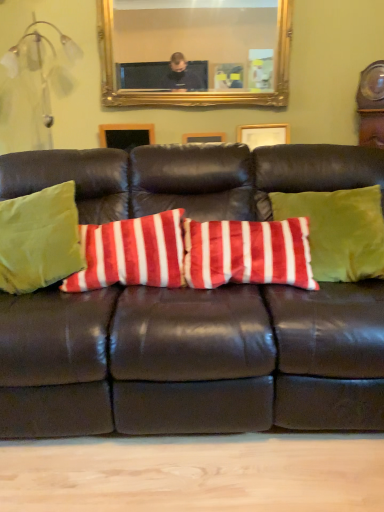
What is the approximate width of matte brown leather couch at center?

matte brown leather couch at center is 1.05 meters in width.

The image size is (384, 512). In order to click on gold-framed mirror at upper center in this screenshot , I will do 194,52.

At what (x,y) coordinates should I click in order to perform the action: click on velvet green pillow at center, placed as the first pillow when sorted from right to left. Please return your answer as a coordinate pair (x, y). This screenshot has width=384, height=512. Looking at the image, I should click on coord(339,231).

At what (x,y) coordinates should I click in order to perform the action: click on matte brown leather couch at center. Please return your answer as a coordinate pair (x, y). This screenshot has height=512, width=384. Looking at the image, I should click on (192, 360).

Is the position of gold-framed mirror at upper center more distant than that of velvet green pillow at center, which is counted as the 3th pillow, starting from the left?

Yes, gold-framed mirror at upper center is further from the camera.

From the image's perspective, is gold-framed mirror at upper center positioned above or below velvet green pillow at center, which is counted as the 3th pillow, starting from the left?

Clearly, from the image's perspective, gold-framed mirror at upper center is above velvet green pillow at center, which is counted as the 3th pillow, starting from the left.

Between gold-framed mirror at upper center and velvet green pillow at center, placed as the first pillow when sorted from right to left, which one appears on the right side from the viewer's perspective?

Positioned to the right is velvet green pillow at center, placed as the first pillow when sorted from right to left.

Is point (244, 70) closer or farther from the camera than point (383, 246)?

Point (244, 70) is positioned farther from the camera compared to point (383, 246).

At what (x,y) coordinates should I click in order to perform the action: click on pillow located underneath the green velvet pillow at left, the 1th pillow in the left-to-right sequence (from a real-world perspective). Please return your answer as a coordinate pair (x, y). Looking at the image, I should click on (132, 253).

From the image's perspective, is green velvet pillow at left, the 1th pillow in the left-to-right sequence, positioned above or below velvety red and white striped pillow at center, which is the 2th pillow from left to right?

Clearly, from the image's perspective, green velvet pillow at left, the 1th pillow in the left-to-right sequence, is above velvety red and white striped pillow at center, which is the 2th pillow from left to right.

Considering the positions of point (75, 264) and point (128, 241), is point (75, 264) closer or farther from the camera than point (128, 241)?

Point (75, 264) appears to be closer to the viewer than point (128, 241).

Are matte brown leather couch at center and green velvet pillow at left, the third pillow viewed from the right, located far from each other?

No, matte brown leather couch at center is not far away from green velvet pillow at left, the third pillow viewed from the right.

Which is more to the right, matte brown leather couch at center or green velvet pillow at left, the 1th pillow in the left-to-right sequence?

matte brown leather couch at center.

Can you confirm if matte brown leather couch at center is taller than green velvet pillow at left, the third pillow viewed from the right?

Correct, matte brown leather couch at center is much taller as green velvet pillow at left, the third pillow viewed from the right.

In terms of size, does velvet green pillow at center, placed as the first pillow when sorted from right to left, appear bigger or smaller than green velvet pillow at left, the third pillow viewed from the right?

In the image, velvet green pillow at center, placed as the first pillow when sorted from right to left, appears to be smaller than green velvet pillow at left, the third pillow viewed from the right.

From the image's perspective, which is above, velvet green pillow at center, placed as the first pillow when sorted from right to left, or green velvet pillow at left, the third pillow viewed from the right?

velvet green pillow at center, placed as the first pillow when sorted from right to left.

From a real-world perspective, is velvet green pillow at center, placed as the first pillow when sorted from right to left, located higher than green velvet pillow at left, the third pillow viewed from the right?

Indeed, from a real-world perspective, velvet green pillow at center, placed as the first pillow when sorted from right to left, stands above green velvet pillow at left, the third pillow viewed from the right.

Does velvet green pillow at center, placed as the first pillow when sorted from right to left, turn towards green velvet pillow at left, the 1th pillow in the left-to-right sequence?

No, velvet green pillow at center, placed as the first pillow when sorted from right to left, is not facing towards green velvet pillow at left, the 1th pillow in the left-to-right sequence.

From a real-world perspective, who is located higher, matte brown leather couch at center or velvety red and white striped pillow at center, which is the 2th pillow from left to right?

From a 3D spatial view, velvety red and white striped pillow at center, which is the 2th pillow from left to right, is above.

There is a matte brown leather couch at center. Identify the location of the 1st pillow above it (from the image's perspective). This screenshot has width=384, height=512. (132, 253).

Considering the relative sizes of matte brown leather couch at center and velvety red and white striped pillow at center, which is the 2th pillow from left to right, in the image provided, is matte brown leather couch at center taller than velvety red and white striped pillow at center, which is the 2th pillow from left to right,?

Correct, matte brown leather couch at center is much taller as velvety red and white striped pillow at center, which is the 2th pillow from left to right.

Is point (96, 277) closer to viewer compared to point (136, 192)?

Yes, it is.

Does velvety red and white striped pillow at center, the second pillow in the right-to-left sequence, have a larger size compared to matte brown leather couch at center?

No.

Considering the relative positions of velvety red and white striped pillow at center, the second pillow in the right-to-left sequence, and matte brown leather couch at center in the image provided, is velvety red and white striped pillow at center, the second pillow in the right-to-left sequence, to the right of matte brown leather couch at center from the viewer's perspective?

Incorrect, velvety red and white striped pillow at center, the second pillow in the right-to-left sequence, is not on the right side of matte brown leather couch at center.

Is velvety red and white striped pillow at center, the second pillow in the right-to-left sequence, spatially inside matte brown leather couch at center, or outside of it?

velvety red and white striped pillow at center, the second pillow in the right-to-left sequence, is contained in matte brown leather couch at center.

Between green velvet pillow at left, the 1th pillow in the left-to-right sequence, and gold-framed mirror at upper center, which one has more height?

green velvet pillow at left, the 1th pillow in the left-to-right sequence.

Between green velvet pillow at left, the third pillow viewed from the right, and gold-framed mirror at upper center, which one has smaller size?

gold-framed mirror at upper center is smaller.

From the image's perspective, is green velvet pillow at left, the 1th pillow in the left-to-right sequence, beneath gold-framed mirror at upper center?

Yes, from the image's perspective, green velvet pillow at left, the 1th pillow in the left-to-right sequence, is below gold-framed mirror at upper center.

Is point (15, 198) more distant than point (119, 68)?

No.

Image resolution: width=384 pixels, height=512 pixels. Find the location of `the 2nd pillow in front of the gold-framed mirror at upper center, starting your count from the anchor`. the 2nd pillow in front of the gold-framed mirror at upper center, starting your count from the anchor is located at coordinates (339, 231).

This screenshot has height=512, width=384. Identify the location of pillow that appears below the green velvet pillow at left, the 1th pillow in the left-to-right sequence (from a real-world perspective). (132, 253).

Which object lies further to the anchor point gold-framed mirror at upper center, velvety red and white striped pillow at center, the second pillow in the right-to-left sequence, or matte brown leather couch at center?

The object further to gold-framed mirror at upper center is matte brown leather couch at center.

Based on the photo, which object lies nearer to the anchor point matte brown leather couch at center, gold-framed mirror at upper center or velvet green pillow at center, placed as the first pillow when sorted from right to left?

velvet green pillow at center, placed as the first pillow when sorted from right to left, lies closer to matte brown leather couch at center than the other object.

Which object lies further to the anchor point velvet green pillow at center, which is counted as the 3th pillow, starting from the left, velvety red and white striped pillow at center, which is the 2th pillow from left to right, or gold-framed mirror at upper center?

The object further to velvet green pillow at center, which is counted as the 3th pillow, starting from the left, is gold-framed mirror at upper center.

From the image, which object appears to be farther from green velvet pillow at left, the third pillow viewed from the right, gold-framed mirror at upper center or velvety red and white striped pillow at center, the second pillow in the right-to-left sequence?

gold-framed mirror at upper center.

Consider the image. Estimate the real-world distances between objects in this image. Which object is further from matte brown leather couch at center, velvety red and white striped pillow at center, the second pillow in the right-to-left sequence, or gold-framed mirror at upper center?

Among the two, gold-framed mirror at upper center is located further to matte brown leather couch at center.

From the picture: Based on their spatial positions, is matte brown leather couch at center or velvety red and white striped pillow at center, the second pillow in the right-to-left sequence, closer to velvet green pillow at center, placed as the first pillow when sorted from right to left?

matte brown leather couch at center is positioned closer to the anchor velvet green pillow at center, placed as the first pillow when sorted from right to left.

Consider the image. When comparing their distances from velvet green pillow at center, placed as the first pillow when sorted from right to left, does matte brown leather couch at center or gold-framed mirror at upper center seem closer?

Based on the image, matte brown leather couch at center appears to be nearer to velvet green pillow at center, placed as the first pillow when sorted from right to left.

Based on their spatial positions, is velvet green pillow at center, placed as the first pillow when sorted from right to left, or velvety red and white striped pillow at center, which is the 2th pillow from left to right, closer to gold-framed mirror at upper center?

A: velvety red and white striped pillow at center, which is the 2th pillow from left to right, is closer to gold-framed mirror at upper center.

Where is `studio couch situated between velvety red and white striped pillow at center, which is the 2th pillow from left to right, and velvet green pillow at center, which is counted as the 3th pillow, starting from the left, from left to right`? The width and height of the screenshot is (384, 512). studio couch situated between velvety red and white striped pillow at center, which is the 2th pillow from left to right, and velvet green pillow at center, which is counted as the 3th pillow, starting from the left, from left to right is located at coordinates (192, 360).

Find the location of a particular element. The width and height of the screenshot is (384, 512). mirror situated between green velvet pillow at left, the third pillow viewed from the right, and velvet green pillow at center, placed as the first pillow when sorted from right to left, from left to right is located at coordinates (194, 52).

At what (x,y) coordinates should I click in order to perform the action: click on pillow between green velvet pillow at left, the third pillow viewed from the right, and matte brown leather couch at center from left to right. Please return your answer as a coordinate pair (x, y). This screenshot has height=512, width=384. Looking at the image, I should click on (132, 253).

Where is `pillow between green velvet pillow at left, the 1th pillow in the left-to-right sequence, and velvet green pillow at center, which is counted as the 3th pillow, starting from the left`? pillow between green velvet pillow at left, the 1th pillow in the left-to-right sequence, and velvet green pillow at center, which is counted as the 3th pillow, starting from the left is located at coordinates (132, 253).